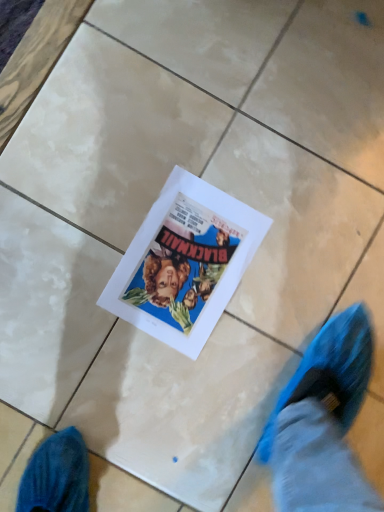
Locate an element on the screen. Image resolution: width=384 pixels, height=512 pixels. vacant area situated below white paper at center (from a real-world perspective) is located at coordinates (185, 261).